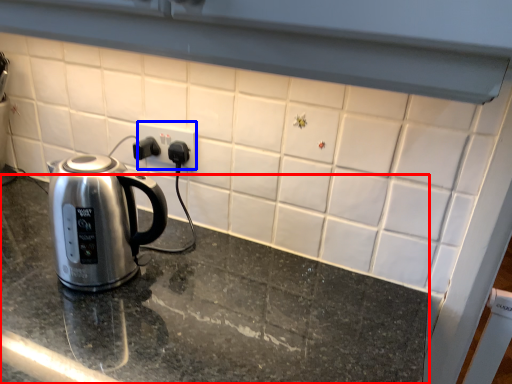
Question: Among these objects, which one is nearest to the camera, table top (highlighted by a red box) or electric outlet (highlighted by a blue box)?

Choices:
 (A) table top
 (B) electric outlet

Answer: (A)